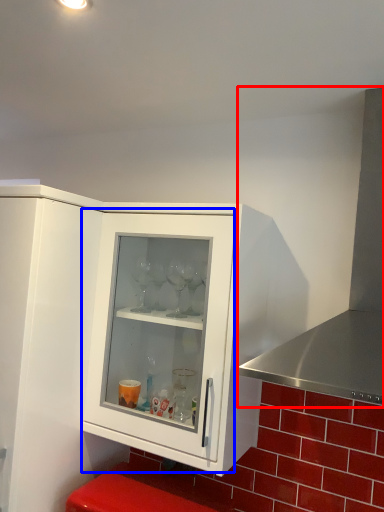
Question: Which object is closer to the camera taking this photo, exhaust hood (highlighted by a red box) or glass door (highlighted by a blue box)?

Choices:
 (A) exhaust hood
 (B) glass door

Answer: (A)